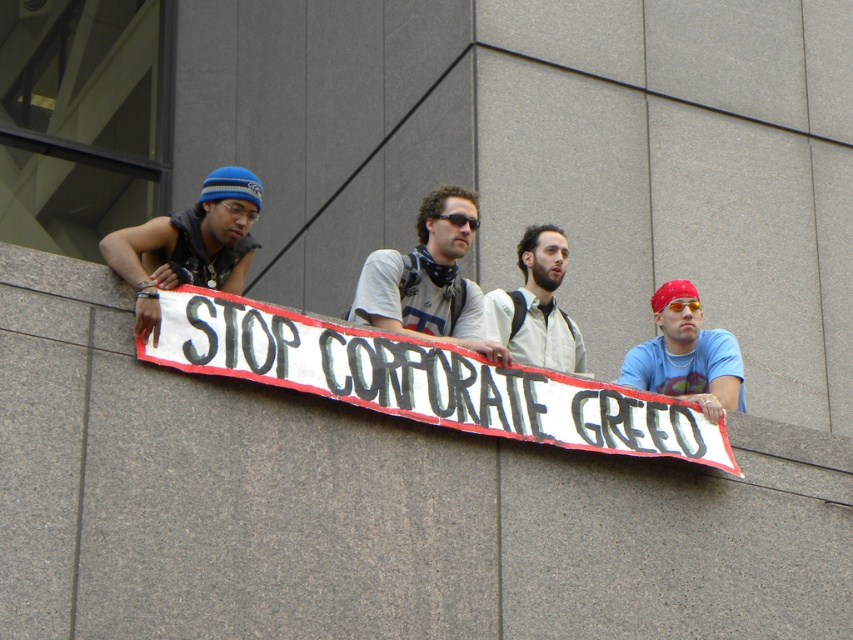
Question: Among these points, which one is farthest from the camera?

Choices:
 (A) (642, 369)
 (B) (235, 356)

Answer: (A)

Question: Is black plastic sunglasses at center wider than orange reflective goggles at center?

Choices:
 (A) no
 (B) yes

Answer: (B)

Question: Which object appears farthest from the camera in this image?

Choices:
 (A) white t-shirt at center
 (B) black plastic sunglasses at center
 (C) orange reflective goggles at center

Answer: (C)

Question: Considering the real-world distances, which object is closest to the white shirt at center?

Choices:
 (A) white t-shirt at center
 (B) blue knit cap at upper left

Answer: (A)

Question: Can you confirm if matte blue beanie at upper left is smaller than black plastic sunglasses at center?

Choices:
 (A) yes
 (B) no

Answer: (B)

Question: Considering the relative positions of white t-shirt at center and red bandana at right in the image provided, where is white t-shirt at center located with respect to red bandana at right?

Choices:
 (A) below
 (B) above

Answer: (B)